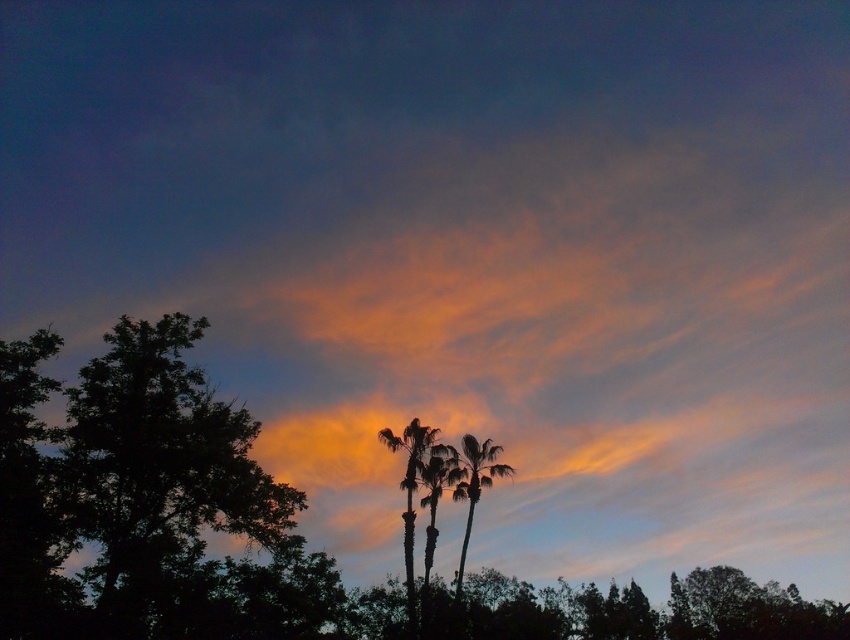
You are standing in the sunset scene and want to take a photo of the green leafy palm tree at center. Where should you aim your camera to capture it in the frame?

You should aim your camera at the point 0.759 on the x axis and 0.558 on the y axis to capture the green leafy palm tree at center.

From the picture: In the sunset scene, you notice two palm trees at the center of the image. The first is labeled as silhouette palm trees at center, and the second is green leafy palm tree at center. Which of these two palm trees appears higher in the image?

The silhouette palm trees at center appears higher in the image than the green leafy palm tree at center.